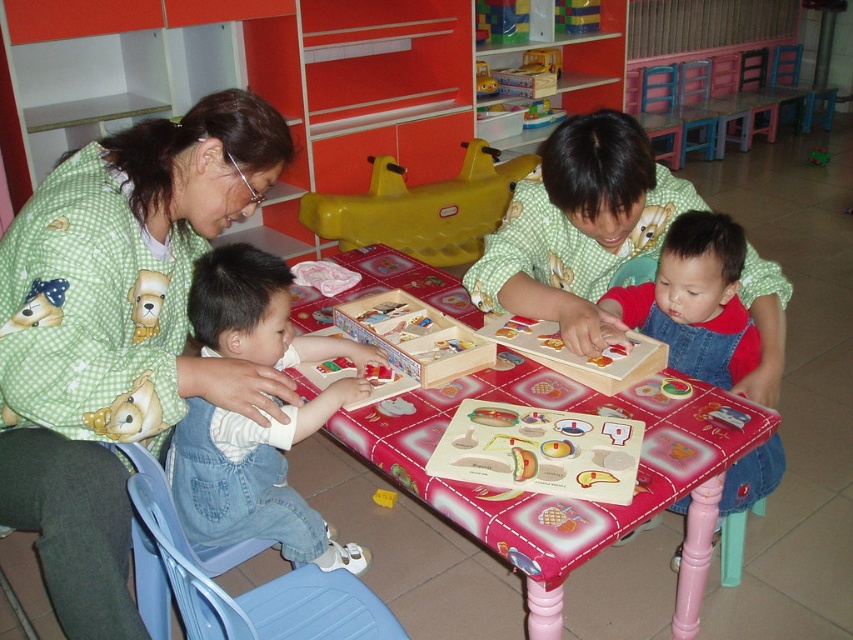
Is denim overalls at lower left bigger than denim overalls at lower right?

Indeed, denim overalls at lower left has a larger size compared to denim overalls at lower right.

Does denim overalls at lower left appear over denim overalls at lower right?

No.

At what (x,y) coordinates should I click in order to perform the action: click on denim overalls at lower left. Please return your answer as a coordinate pair (x, y). This screenshot has height=640, width=853. Looking at the image, I should click on (254, 480).

Find the location of `denim overalls at lower left`. denim overalls at lower left is located at coordinates (254, 480).

Measure the distance between point (698,385) and camera.

5.05 feet

Measure the distance between wooden puzzle board at center and camera.

wooden puzzle board at center and camera are 1.10 meters apart from each other.

Which is in front, point (752, 420) or point (378, 502)?

Point (752, 420)

I want to click on wooden puzzle board at center, so click(x=547, y=497).

Who is higher up, wooden puzzle board at center or green checkered shirt at center?

green checkered shirt at center is above.

Can you confirm if wooden puzzle board at center is thinner than green checkered shirt at center?

Incorrect, wooden puzzle board at center's width is not less than green checkered shirt at center's.

Between point (711, 387) and point (770, 403), which one is positioned in front?

Point (711, 387) is more forward.

Find the location of a particular element. This screenshot has width=853, height=640. wooden puzzle board at center is located at coordinates (547, 497).